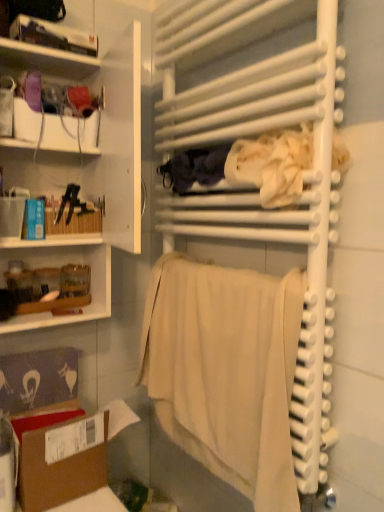
Question: Is white matte cabinet at left, placed as the 1th shelf when sorted from bottom to top, in front of white fabric at center, which ranks as the 2th clothing in left-to-right order?

Choices:
 (A) yes
 (B) no

Answer: (A)

Question: Is white matte cabinet at left, placed as the 1th shelf when sorted from bottom to top, outside white fabric at center, positioned as the first clothing in right-to-left order?

Choices:
 (A) yes
 (B) no

Answer: (A)

Question: From a real-world perspective, is white matte cabinet at left, placed as the 1th shelf when sorted from bottom to top, below white fabric at center, positioned as the first clothing in right-to-left order?

Choices:
 (A) no
 (B) yes

Answer: (B)

Question: Could you tell me if white matte cabinet at left, placed as the 1th shelf when sorted from bottom to top, is facing white fabric at center, which ranks as the 2th clothing in left-to-right order?

Choices:
 (A) yes
 (B) no

Answer: (B)

Question: From the image's perspective, would you say white matte cabinet at left, placed as the second shelf when sorted from top to bottom, is positioned over white fabric at center, which ranks as the 2th clothing in left-to-right order?

Choices:
 (A) yes
 (B) no

Answer: (B)

Question: Is white glossy bookshelf at upper left, the first shelf from the top, taller or shorter than white matte cabinet at left, placed as the second shelf when sorted from top to bottom?

Choices:
 (A) tall
 (B) short

Answer: (B)

Question: Is white glossy bookshelf at upper left, which ranks as the second shelf in bottom-to-top order, to the left or to the right of white matte cabinet at left, placed as the second shelf when sorted from top to bottom, in the image?

Choices:
 (A) right
 (B) left

Answer: (B)

Question: From the image's perspective, relative to white matte cabinet at left, placed as the 1th shelf when sorted from bottom to top, is white glossy bookshelf at upper left, the first shelf from the top, above or below?

Choices:
 (A) above
 (B) below

Answer: (A)

Question: Is white glossy bookshelf at upper left, which ranks as the second shelf in bottom-to-top order, wider or thinner than white matte cabinet at left, placed as the 1th shelf when sorted from bottom to top?

Choices:
 (A) wide
 (B) thin

Answer: (B)

Question: Looking at their shapes, would you say white matte towel rack at center is wider or thinner than matte white box at upper left?

Choices:
 (A) thin
 (B) wide

Answer: (B)

Question: In the image, is white matte towel rack at center on the left side or the right side of matte white box at upper left?

Choices:
 (A) right
 (B) left

Answer: (A)

Question: From a real-world perspective, relative to matte white box at upper left, is white matte towel rack at center vertically above or below?

Choices:
 (A) below
 (B) above

Answer: (A)

Question: Would you say white matte towel rack at center is inside or outside matte white box at upper left?

Choices:
 (A) inside
 (B) outside

Answer: (B)

Question: Considering the positions of dark blue fabric at center, which appears as the 1th clothing when viewed from the left, and white glossy bookshelf at upper left, the first shelf from the top, in the image, is dark blue fabric at center, which appears as the 1th clothing when viewed from the left, wider or thinner than white glossy bookshelf at upper left, the first shelf from the top,?

Choices:
 (A) wide
 (B) thin

Answer: (A)

Question: From a real-world perspective, is dark blue fabric at center, the second clothing when ordered from right to left, physically located above or below white glossy bookshelf at upper left, the first shelf from the top?

Choices:
 (A) above
 (B) below

Answer: (B)